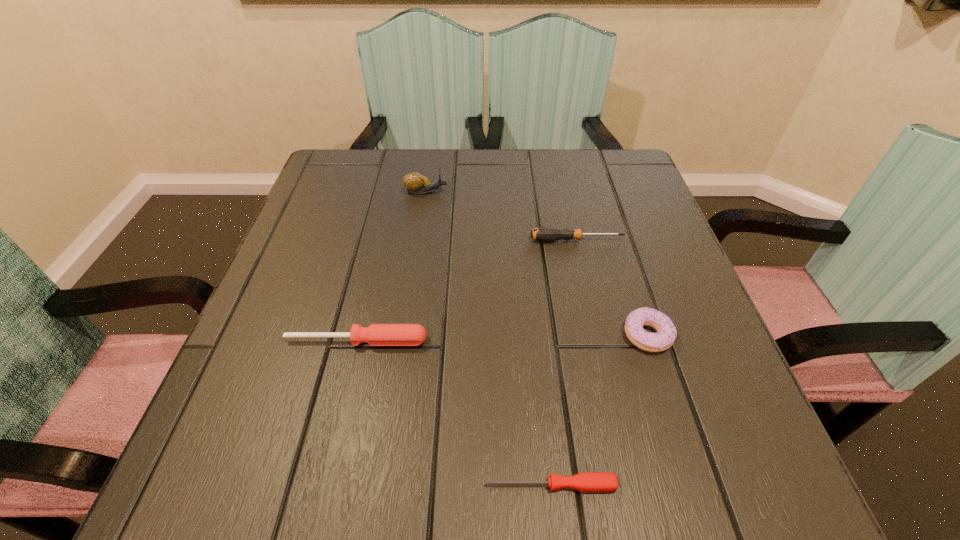
You are a GUI agent. You are given a task and a screenshot of the screen. Output one action in this format:
    pyautogui.click(x=<x>, y=<y>)
    Task: Click on the vacant space that satisfies the following two spatial constraints: 1. on the front side of the farthest screwdriver; 2. at the tip of the nearest screwdriver
    The image size is (960, 540).
    Given the screenshot: What is the action you would take?
    pyautogui.click(x=633, y=485)

At what (x,y) coordinates should I click in order to perform the action: click on free space that satisfies the following two spatial constraints: 1. on the front-facing side of the tallest object; 2. on the right side of the doughnut. Please return your answer as a coordinate pair (x, y). The width and height of the screenshot is (960, 540). Looking at the image, I should click on (407, 335).

You are a GUI agent. You are given a task and a screenshot of the screen. Output one action in this format:
    pyautogui.click(x=<x>, y=<y>)
    Task: Click on the vacant space that satisfies the following two spatial constraints: 1. on the back side of the farthest screwdriver; 2. on the front-facing side of the farthest object
    The width and height of the screenshot is (960, 540).
    Given the screenshot: What is the action you would take?
    pyautogui.click(x=565, y=192)

This screenshot has height=540, width=960. I want to click on free spot that satisfies the following two spatial constraints: 1. on the front-facing side of the escargot; 2. on the left side of the farthest screwdriver, so click(x=420, y=240).

Where is `vacant point that satisfies the following two spatial constraints: 1. on the front side of the farthest screwdriver; 2. at the tip of the shortest screwdriver`? This screenshot has height=540, width=960. vacant point that satisfies the following two spatial constraints: 1. on the front side of the farthest screwdriver; 2. at the tip of the shortest screwdriver is located at coordinates (633, 485).

Image resolution: width=960 pixels, height=540 pixels. Identify the location of free spot that satisfies the following two spatial constraints: 1. on the front-facing side of the escargot; 2. on the back side of the farthest screwdriver. (420, 240).